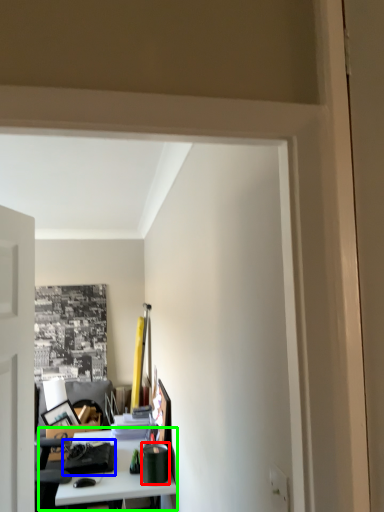
Question: Considering the real-world distances, which object is farthest from stationery (highlighted by a red box)? stationery (highlighted by a blue box) or table (highlighted by a green box)?

Choices:
 (A) stationery
 (B) table

Answer: (A)